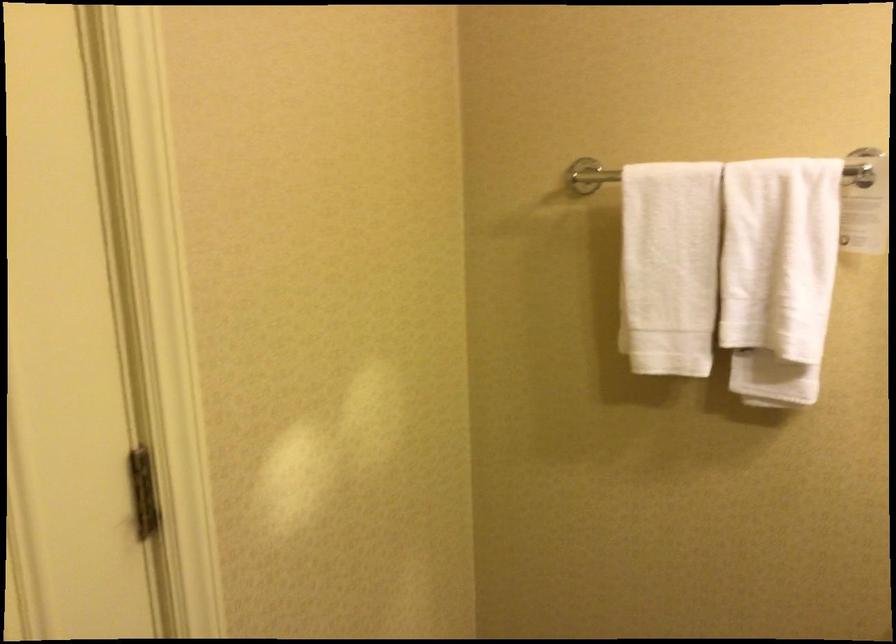
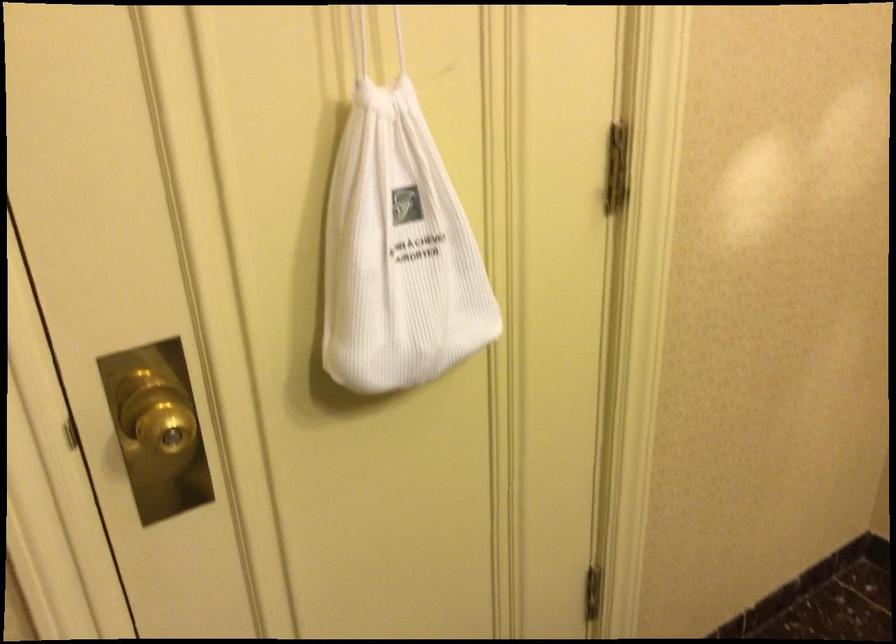
The first image is from the beginning of the video and the second image is from the end. How did the camera likely rotate when shooting the video?

The rotation direction of the camera is left-down.